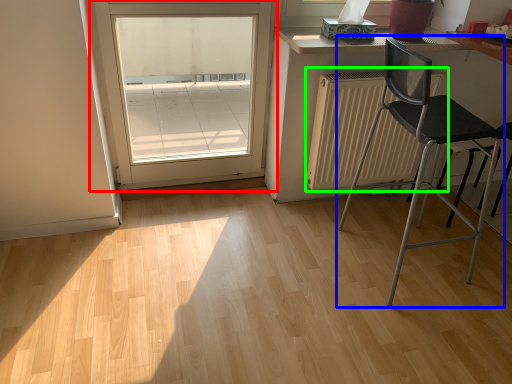
Question: Which object is the closest to the door (highlighted by a red box)? Choose among these: chair (highlighted by a blue box) or radiator (highlighted by a green box).

Choices:
 (A) chair
 (B) radiator

Answer: (B)